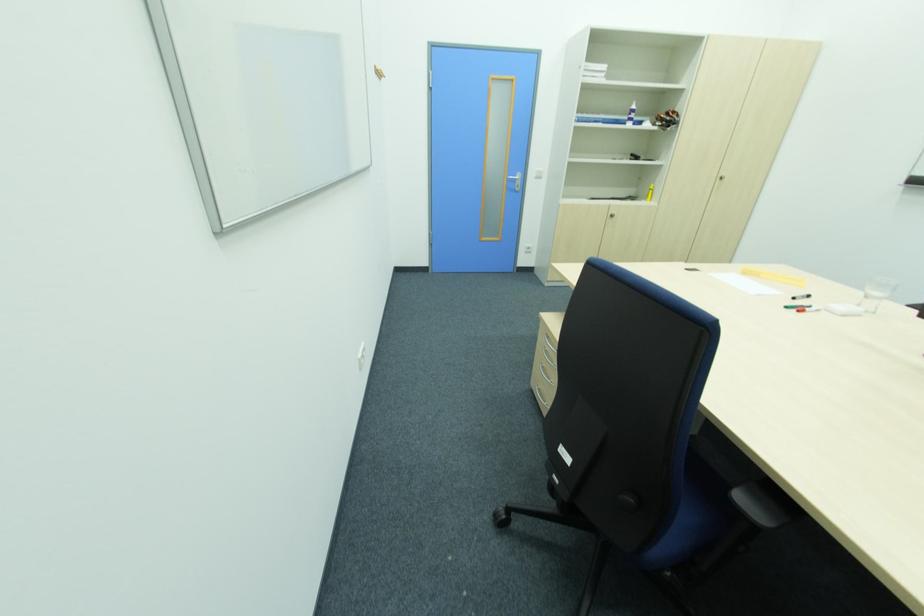
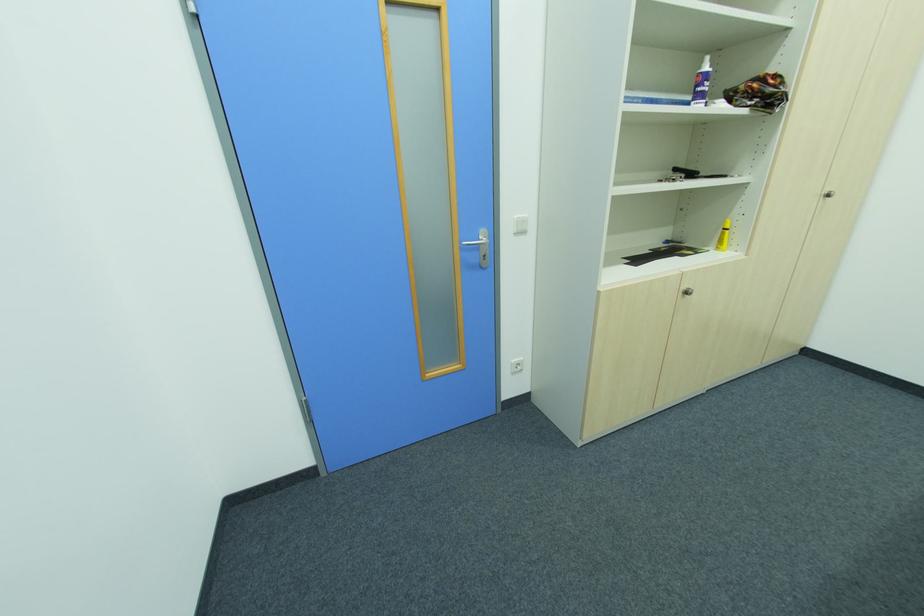
Find the pixel in the second image that matches [529,246] in the first image.

(516, 362)